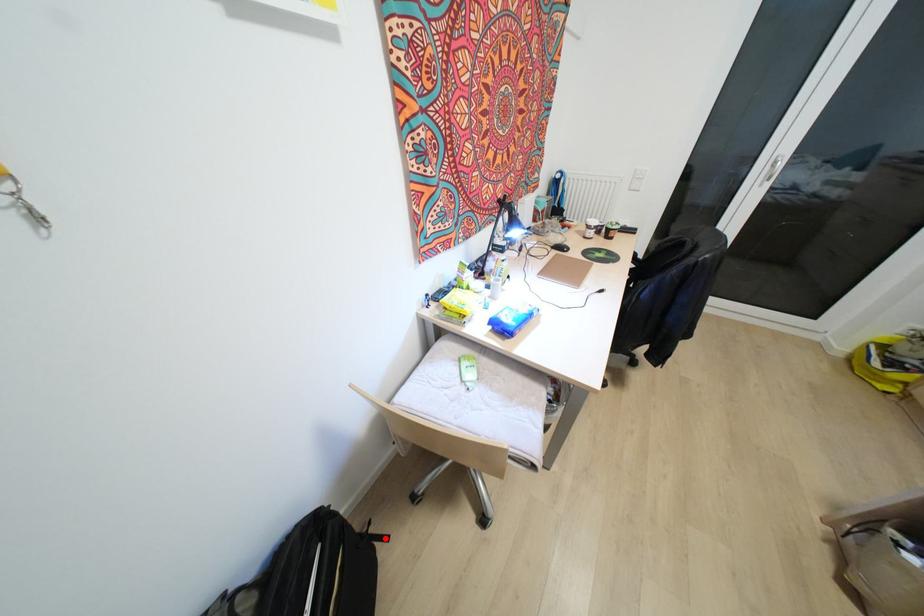
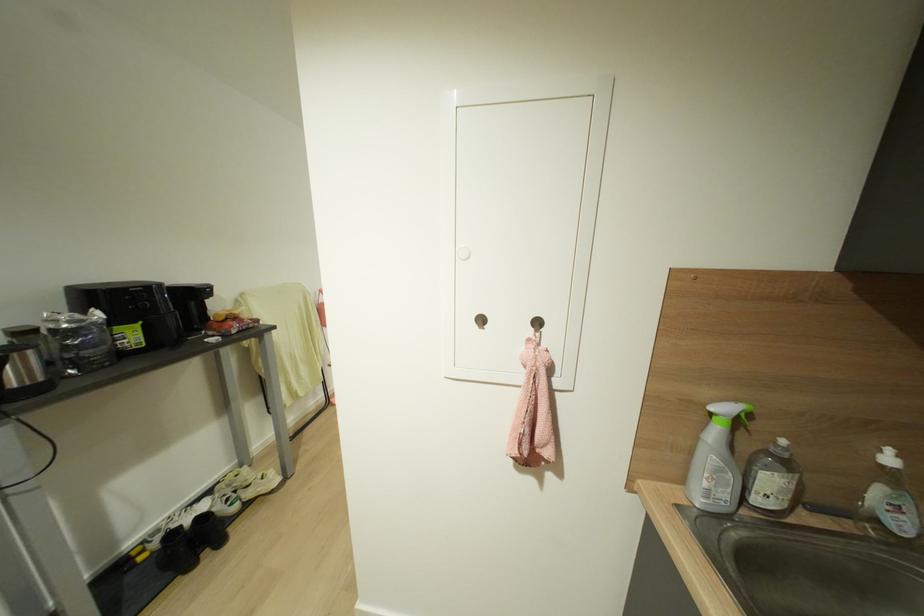
Question: I am providing you with two images of the same scene from different viewpoints. A red point is marked on the first image. Is the red point's position out of view in image 2?

Choices:
 (A) Yes
 (B) No

Answer: (A)